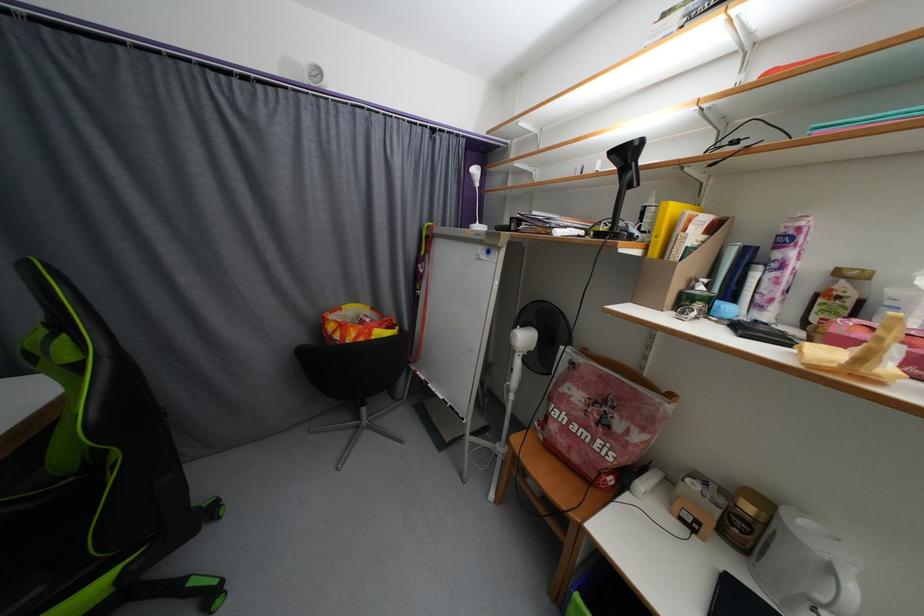
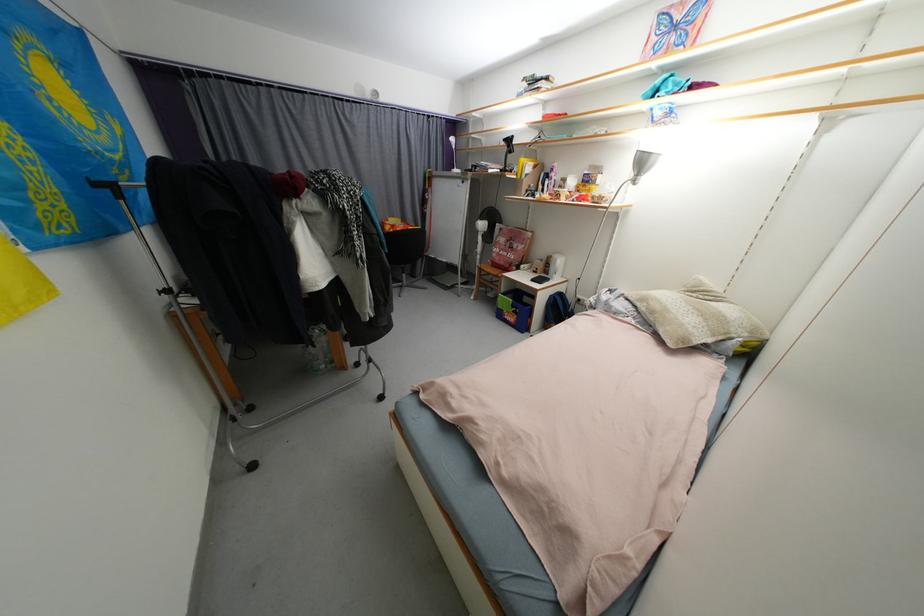
The point at (x=772, y=507) is marked in the first image. Where is the corresponding point in the second image?

(557, 257)